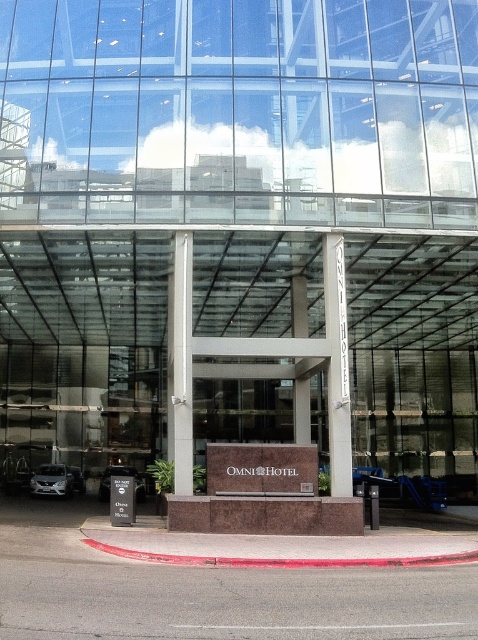
Between satin silver sedan at lower left and shiny silver car at lower left, which one appears on the right side from the viewer's perspective?

Positioned to the right is shiny silver car at lower left.

Does satin silver sedan at lower left have a larger size compared to shiny silver car at lower left?

Yes, satin silver sedan at lower left is bigger than shiny silver car at lower left.

Where is `satin silver sedan at lower left`? satin silver sedan at lower left is located at coordinates (52, 481).

Is white stone sign at center positioned behind shiny silver car at lower left?

No, it is not.

Consider the image. Measure the distance between point (348, 428) and camera.

The distance of point (348, 428) from camera is 15.91 meters.

You are a GUI agent. You are given a task and a screenshot of the screen. Output one action in this format:
    pyautogui.click(x=<x>, y=<y>)
    Task: Click on the white stone sign at center
    The image size is (478, 640).
    Given the screenshot: What is the action you would take?
    pyautogui.click(x=336, y=365)

Can you confirm if white stone sign at center is taller than satin silver sedan at lower left?

Yes, white stone sign at center is taller than satin silver sedan at lower left.

Does white stone sign at center have a greater width compared to satin silver sedan at lower left?

In fact, white stone sign at center might be narrower than satin silver sedan at lower left.

Identify the location of white stone sign at center. (336, 365).

Find the location of a particular element. This screenshot has width=478, height=640. white stone sign at center is located at coordinates (336, 365).